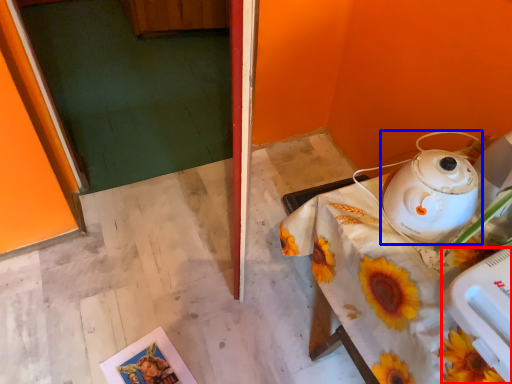
Question: Among these objects, which one is nearest to the camera, appliance (highlighted by a red box) or kettle (highlighted by a blue box)?

Choices:
 (A) appliance
 (B) kettle

Answer: (A)